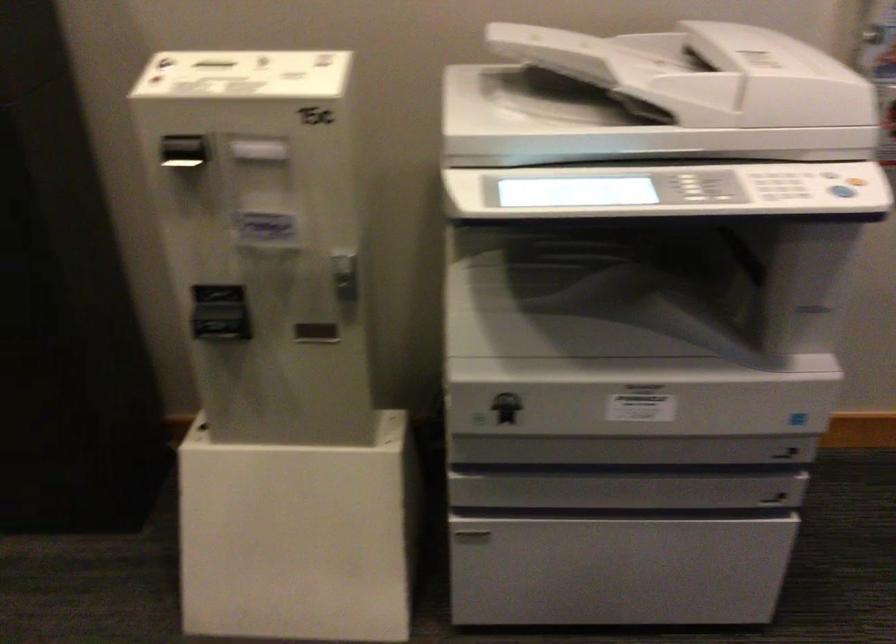
Locate an element on the screen. The width and height of the screenshot is (896, 644). blue start button is located at coordinates (841, 191).